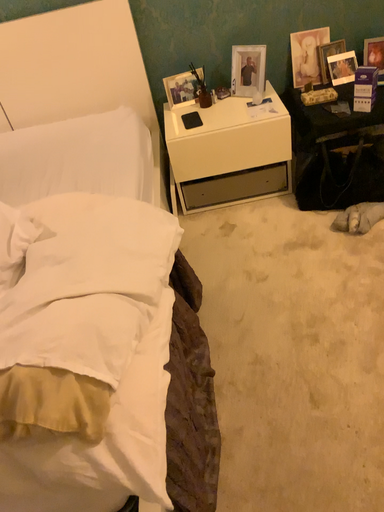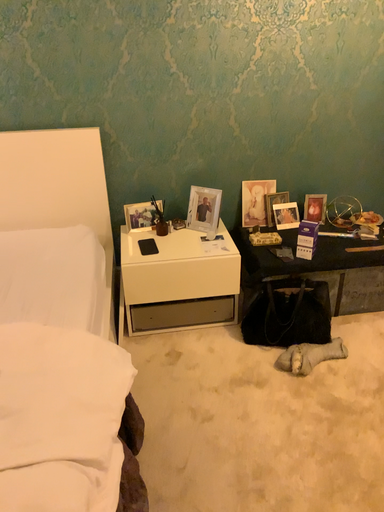
Question: How did the camera likely rotate when shooting the video?

Choices:
 (A) rotated right
 (B) rotated left

Answer: (A)